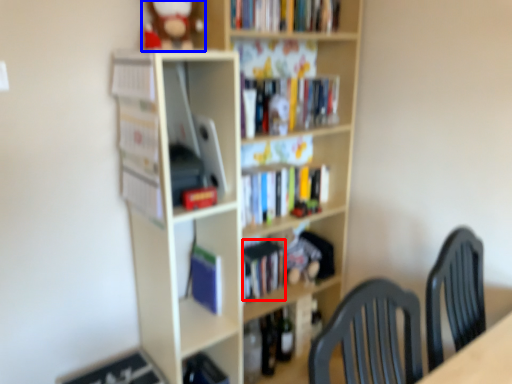
Question: Which object appears farthest to the camera in this image, book (highlighted by a red box) or toy (highlighted by a blue box)?

Choices:
 (A) book
 (B) toy

Answer: (A)